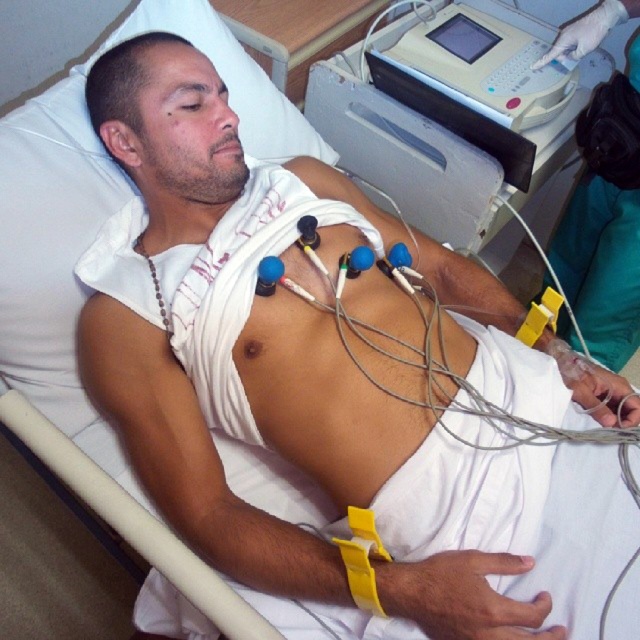
Between point (490, 173) and point (509, 88), which one is positioned in front?

Point (490, 173)

Which is more to the left, gray plastic machine at upper right or white plastic machine at upper right?

gray plastic machine at upper right is more to the left.

Find the location of a particular element. Image resolution: width=640 pixels, height=640 pixels. gray plastic machine at upper right is located at coordinates (432, 152).